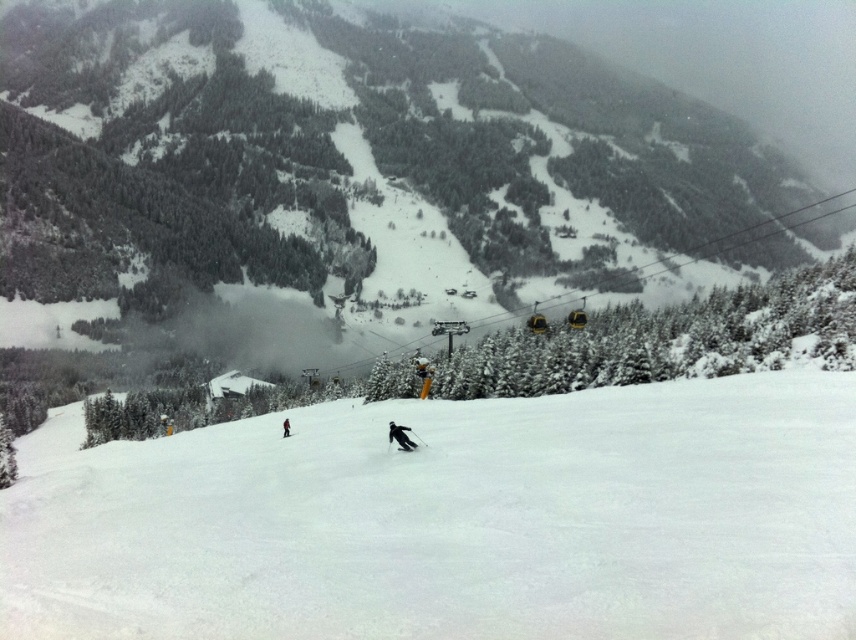
Who is positioned more to the left, red fabric jacket at center or black matte ski at center?

Positioned to the left is red fabric jacket at center.

Who is lower down, red fabric jacket at center or black matte ski at center?

Positioned lower is red fabric jacket at center.

Is point (284, 426) farther from viewer compared to point (409, 448)?

Yes, point (284, 426) is farther from viewer.

Identify the location of red fabric jacket at center. (284, 428).

Between point (409, 445) and point (286, 420), which one is positioned behind?

The point (286, 420) is behind.

Which is in front, point (393, 429) or point (286, 417)?

Positioned in front is point (393, 429).

What do you see at coordinates (400, 436) in the screenshot? I see `black matte skier at center` at bounding box center [400, 436].

The image size is (856, 640). I want to click on black matte skier at center, so [400, 436].

Who is lower down, white snow ski slope at center or black matte ski at center?

white snow ski slope at center is below.

The height and width of the screenshot is (640, 856). Describe the element at coordinates (450, 520) in the screenshot. I see `white snow ski slope at center` at that location.

Find the location of a particular element. white snow ski slope at center is located at coordinates (450, 520).